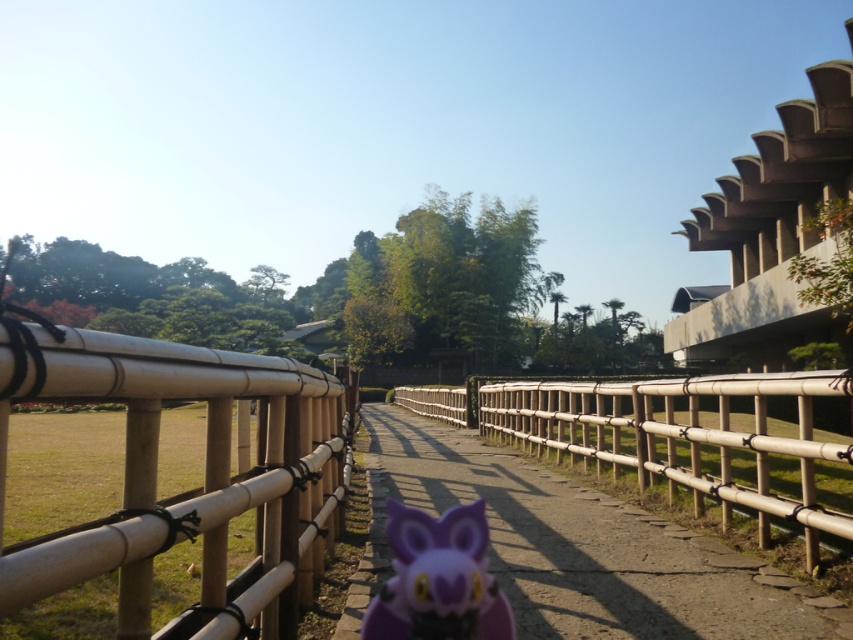
Does natural bamboo fence at center appear under purple matte owl at center?

No.

Is point (213, 484) positioned behind point (393, 593)?

That is False.

Find the location of a particular element. natural bamboo fence at center is located at coordinates (193, 486).

Does purple plastic owl at center appear under purple matte owl at center?

Correct, purple plastic owl at center is located below purple matte owl at center.

Is purple plastic owl at center wider than purple matte owl at center?

Correct, the width of purple plastic owl at center exceeds that of purple matte owl at center.

Between point (393, 420) and point (460, 525), which one is positioned in front?

Positioned in front is point (460, 525).

This screenshot has width=853, height=640. Find the location of `purple plastic owl at center`. purple plastic owl at center is located at coordinates (576, 548).

Image resolution: width=853 pixels, height=640 pixels. Describe the element at coordinates (193, 486) in the screenshot. I see `natural bamboo fence at center` at that location.

Can you confirm if natural bamboo fence at center is taller than purple plastic owl at center?

Indeed, natural bamboo fence at center has a greater height compared to purple plastic owl at center.

Who is more distant from viewer, (299, 451) or (595, 618)?

Point (595, 618)

The width and height of the screenshot is (853, 640). What are the coordinates of `natural bamboo fence at center` in the screenshot? It's located at (193, 486).